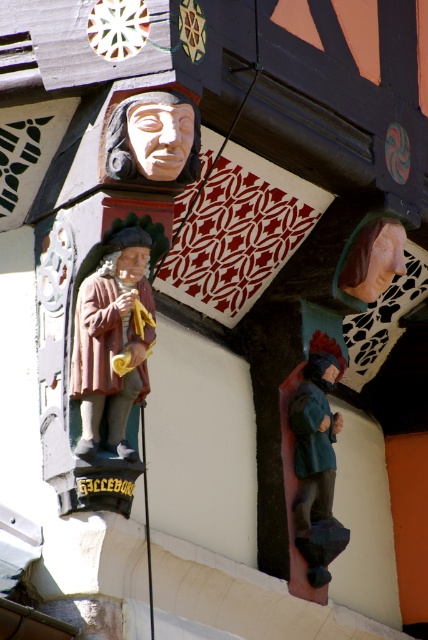
Question: Which point is farther to the camera?

Choices:
 (A) (149, 147)
 (B) (297, 470)

Answer: (B)

Question: Is wooden statue at left wider than wooden head at upper right?

Choices:
 (A) yes
 (B) no

Answer: (B)

Question: Which point is closer to the camera?

Choices:
 (A) (125, 234)
 (B) (124, 115)
 (C) (362, 228)

Answer: (B)

Question: Which object appears closest to the camera in this image?

Choices:
 (A) wooden carving at upper center
 (B) wooden statue at left
 (C) wooden figure at lower right
 (D) wooden head at upper right

Answer: (A)

Question: Where is wooden statue at left located in relation to wooden carving at upper center in the image?

Choices:
 (A) right
 (B) left

Answer: (B)

Question: In this image, where is wooden statue at left located relative to wooden head at upper right?

Choices:
 (A) right
 (B) left

Answer: (B)